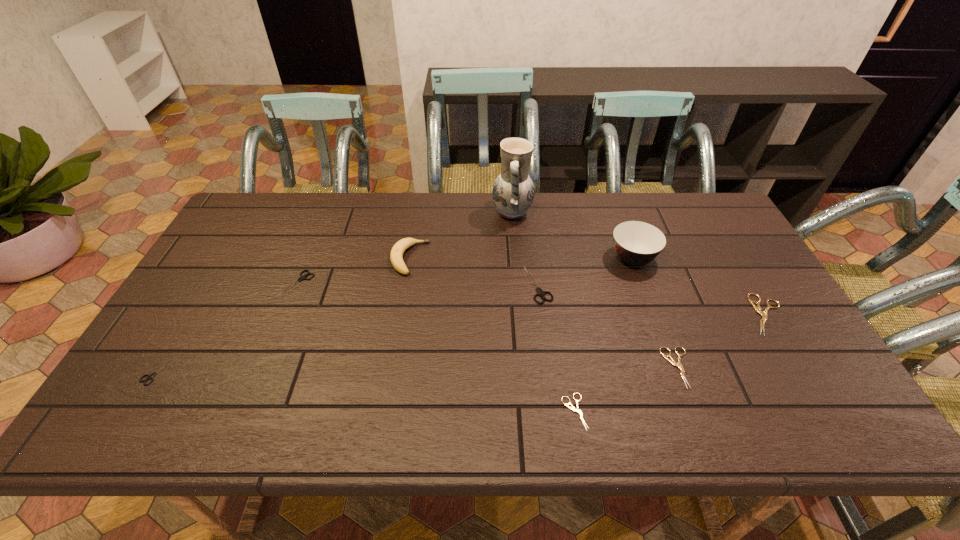
At what (x,y) coordinates should I click in order to perform the action: click on free space that is in between the second tallest object and the leftmost object. Please return your answer as a coordinate pair (x, y). This screenshot has height=540, width=960. Looking at the image, I should click on (396, 314).

Find the location of a particular element. vacant region between the pottery and the soup bowl is located at coordinates (572, 235).

You are a GUI agent. You are given a task and a screenshot of the screen. Output one action in this format:
    pyautogui.click(x=<x>, y=<y>)
    Task: Click on the vacant area that lies between the shortest object and the third tallest object
    Image resolution: width=960 pixels, height=540 pixels.
    Given the screenshot: What is the action you would take?
    click(x=492, y=335)

Locate an element on the screen. The height and width of the screenshot is (540, 960). free point between the rightmost beige shears and the second beige shears from right to left is located at coordinates (722, 341).

This screenshot has height=540, width=960. What are the coordinates of `free space that is in between the farthest beige shears and the smallest beige shears` in the screenshot? It's located at (670, 363).

You are a GUI agent. You are given a task and a screenshot of the screen. Output one action in this format:
    pyautogui.click(x=<x>, y=<y>)
    Task: Click on the empty space that is in between the second object from left to right and the smallest black shears
    
    Given the screenshot: What is the action you would take?
    pyautogui.click(x=228, y=327)

Identify which object is the fifth closest to the tallest object. Please provide its 2D coordinates. Your answer should be formatted as a tuple, i.e. [(x, y)], where the tuple contains the x and y coordinates of a point satisfying the conditions above.

[(302, 277)]

The width and height of the screenshot is (960, 540). Identify the location of object that is the third nearest to the farthest object. (636, 243).

Identify which shears is the fourth nearest to the rightmost shears. Please provide its 2D coordinates. Your answer should be formatted as a tuple, i.e. [(x, y)], where the tuple contains the x and y coordinates of a point satisfying the conditions above.

[(302, 277)]

What are the coordinates of `the fourth closest shears to the fourth tallest object` in the screenshot? It's located at (302, 277).